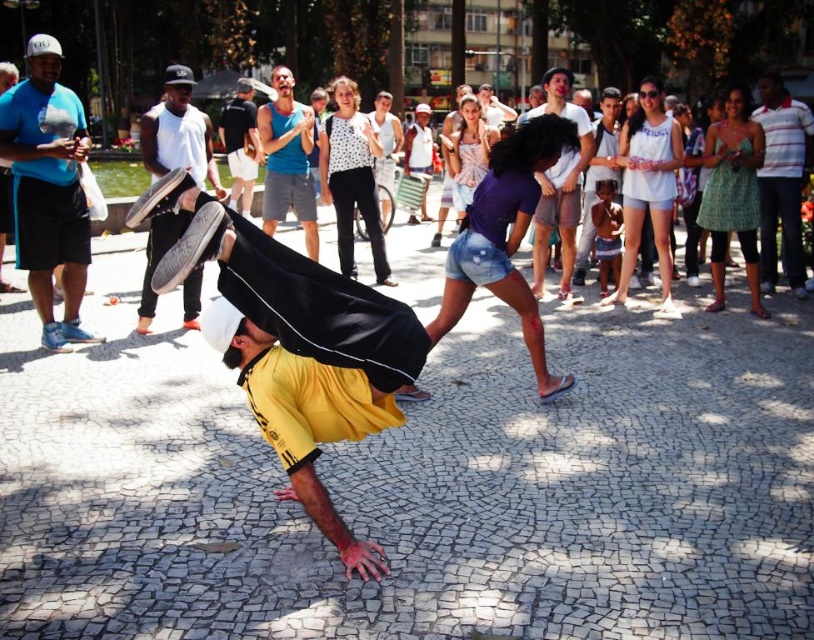
Is point (567, 292) closer to viewer compared to point (291, 170)?

Yes, point (567, 292) is in front of point (291, 170).

Is white cotton t-shirt at center to the left of blue cotton shirt at center from the viewer's perspective?

No, white cotton t-shirt at center is not to the left of blue cotton shirt at center.

Between point (567, 109) and point (283, 144), which one is positioned in front?

Positioned in front is point (567, 109).

The image size is (814, 640). What are the coordinates of `white cotton t-shirt at center` in the screenshot? It's located at (559, 186).

Measure the distance between white canvas drum at upper left and black cotton t-shirt at center.

5.96 meters

Is white canvas drum at upper left bigger than black cotton t-shirt at center?

Actually, white canvas drum at upper left might be smaller than black cotton t-shirt at center.

Between point (193, 275) and point (237, 122), which one is positioned behind?

The point (237, 122) is behind.

I want to click on white canvas drum at upper left, so click(x=177, y=132).

Is point (46, 260) closer to viewer compared to point (296, 157)?

Yes, it is.

From the picture: Who is lower down, blue fabric cap at upper left or blue cotton shirt at center?

blue fabric cap at upper left

This screenshot has width=814, height=640. What do you see at coordinates (47, 188) in the screenshot? I see `blue fabric cap at upper left` at bounding box center [47, 188].

Find the location of a particular element. Image resolution: width=814 pixels, height=640 pixels. blue fabric cap at upper left is located at coordinates (47, 188).